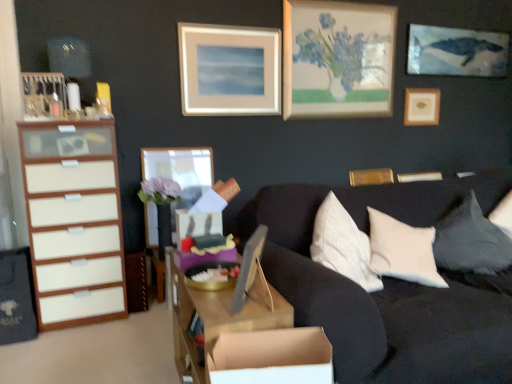
Question: Does wooden picture frame at center, acting as the 5th picture frame starting from the back, appear on the left side of wooden picture frame at center, the fifth picture frame from the right?

Choices:
 (A) yes
 (B) no

Answer: (B)

Question: Is wooden picture frame at center, acting as the 5th picture frame starting from the back, positioned with its back to wooden picture frame at center, arranged as the first picture frame when viewed from the left?

Choices:
 (A) yes
 (B) no

Answer: (B)

Question: Does wooden picture frame at center, marked as the 3th picture frame in a right-to-left arrangement, have a greater height compared to wooden picture frame at center, which is the second picture frame from front to back?

Choices:
 (A) yes
 (B) no

Answer: (B)

Question: From a real-world perspective, is wooden picture frame at center, acting as the 5th picture frame starting from the back, under wooden picture frame at center, arranged as the first picture frame when viewed from the left?

Choices:
 (A) yes
 (B) no

Answer: (B)

Question: Is wooden picture frame at center, acting as the 5th picture frame starting from the back, positioned before wooden picture frame at center, the fifth picture frame from the right?

Choices:
 (A) no
 (B) yes

Answer: (B)

Question: Considering the positions of white wood chest of drawers at left and gold metallic picture frame at upper right, which is counted as the second picture frame, starting from the back, in the image, is white wood chest of drawers at left bigger or smaller than gold metallic picture frame at upper right, which is counted as the second picture frame, starting from the back,?

Choices:
 (A) big
 (B) small

Answer: (A)

Question: Considering the positions of point click(101, 226) and point click(385, 175), is point click(101, 226) closer or farther from the camera than point click(385, 175)?

Choices:
 (A) farther
 (B) closer

Answer: (B)

Question: Looking at their shapes, would you say white wood chest of drawers at left is wider or thinner than gold metallic picture frame at upper right, positioned as the 4th picture frame in left-to-right order?

Choices:
 (A) wide
 (B) thin

Answer: (A)

Question: Would you say white wood chest of drawers at left is inside or outside gold metallic picture frame at upper right, positioned as the 4th picture frame in left-to-right order?

Choices:
 (A) outside
 (B) inside

Answer: (A)

Question: Does point (228, 367) appear closer or farther from the camera than point (161, 170)?

Choices:
 (A) farther
 (B) closer

Answer: (B)

Question: Is cardboard box at lower center taller or shorter than wooden picture frame at center, the fifth picture frame from the right?

Choices:
 (A) short
 (B) tall

Answer: (A)

Question: From the image's perspective, relative to wooden picture frame at center, which is the second picture frame from front to back, is cardboard box at lower center above or below?

Choices:
 (A) below
 (B) above

Answer: (A)

Question: From a real-world perspective, is cardboard box at lower center positioned above or below wooden picture frame at center, which is the second picture frame from front to back?

Choices:
 (A) below
 (B) above

Answer: (A)

Question: Considering the positions of wooden picture frame at upper right, which is the fifth picture frame in front-to-back order, and matte wooden picture frame at upper center, which is counted as the fourth picture frame, starting from the right, in the image, is wooden picture frame at upper right, which is the fifth picture frame in front-to-back order, taller or shorter than matte wooden picture frame at upper center, which is counted as the fourth picture frame, starting from the right,?

Choices:
 (A) tall
 (B) short

Answer: (B)

Question: Looking at their shapes, would you say wooden picture frame at upper right, which is the fifth picture frame in front-to-back order, is wider or thinner than matte wooden picture frame at upper center, the third picture frame viewed from the back?

Choices:
 (A) thin
 (B) wide

Answer: (B)